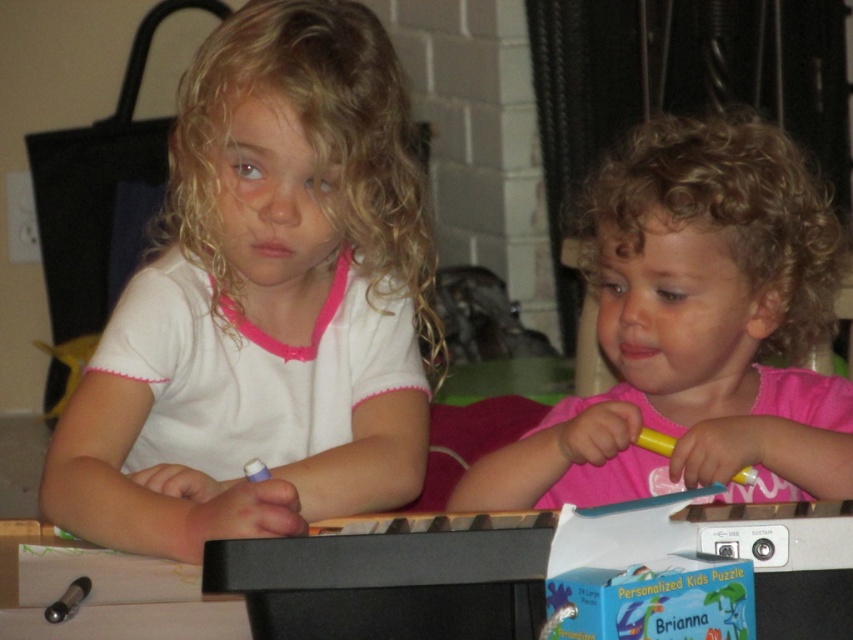
Based on the photo, is white matte shirt at center shorter than pink matte shirt at center?

In fact, white matte shirt at center may be taller than pink matte shirt at center.

Can you confirm if white matte shirt at center is taller than pink matte shirt at center?

Indeed, white matte shirt at center has a greater height compared to pink matte shirt at center.

Between point (314, 177) and point (619, 339), which one is positioned in front?

Point (314, 177)

Find the location of a particular element. This screenshot has height=640, width=853. white matte shirt at center is located at coordinates (264, 304).

Which of these two, pink matte shirt at center or yellow matte crayon at lower center, stands shorter?

Standing shorter between the two is yellow matte crayon at lower center.

Between point (773, 292) and point (752, 481), which one is positioned in front?

Positioned in front is point (752, 481).

You are a GUI agent. You are given a task and a screenshot of the screen. Output one action in this format:
    pyautogui.click(x=<x>, y=<y>)
    Task: Click on the pink matte shirt at center
    The width and height of the screenshot is (853, 640).
    Given the screenshot: What is the action you would take?
    (x=695, y=330)

Is point (352, 422) more distant than point (637, 444)?

Yes, it is behind point (637, 444).

Between point (155, 419) and point (744, 476), which one is positioned behind?

The point (155, 419) is behind.

Does point (345, 481) come closer to viewer compared to point (666, 456)?

No, (345, 481) is further to viewer.

Identify the location of white matte shirt at center. (264, 304).